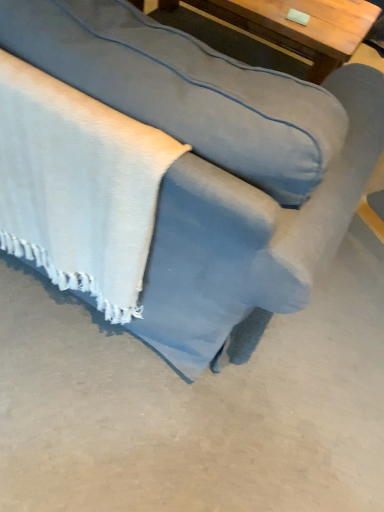
Describe the element at coordinates (217, 167) in the screenshot. I see `suede-like blue couch at center` at that location.

Find the location of a particular element. white textured blanket at lower left is located at coordinates (78, 187).

Looking at this image, is suede-like blue couch at center not near white textured blanket at lower left?

No, suede-like blue couch at center is not far away from white textured blanket at lower left.

Which of these two, suede-like blue couch at center or white textured blanket at lower left, stands taller?

suede-like blue couch at center is taller.

From a real-world perspective, which is physically below, suede-like blue couch at center or white textured blanket at lower left?

From a 3D spatial view, white textured blanket at lower left is below.

Is suede-like blue couch at center positioned with its back to white textured blanket at lower left?

Yes, suede-like blue couch at center's orientation is away from white textured blanket at lower left.

Is point (281, 152) positioned in front of point (256, 12)?

Yes, point (281, 152) is in front of point (256, 12).

Would you say suede-like blue couch at center is inside or outside wooden table at upper center?

suede-like blue couch at center cannot be found inside wooden table at upper center.

From a real-world perspective, who is located lower, suede-like blue couch at center or wooden table at upper center?

wooden table at upper center, from a real-world perspective.

From the image's perspective, which is above, suede-like blue couch at center or wooden table at upper center?

wooden table at upper center.

In the image, is white textured blanket at lower left positioned in front of or behind suede-like blue couch at center?

Visually, white textured blanket at lower left is located behind suede-like blue couch at center.

From the image's perspective, is white textured blanket at lower left over suede-like blue couch at center?

No, from the image's perspective, white textured blanket at lower left is not over suede-like blue couch at center.

Is white textured blanket at lower left at the right side of suede-like blue couch at center?

In fact, white textured blanket at lower left is to the left of suede-like blue couch at center.

Is there a large distance between white textured blanket at lower left and suede-like blue couch at center?

Actually, white textured blanket at lower left and suede-like blue couch at center are a little close together.

Who is shorter, white textured blanket at lower left or wooden table at upper center?

With less height is wooden table at upper center.

Where is `table on the right of white textured blanket at lower left`? table on the right of white textured blanket at lower left is located at coordinates (287, 30).

Looking at this image, is there a large distance between white textured blanket at lower left and wooden table at upper center?

white textured blanket at lower left is positioned a significant distance from wooden table at upper center.

How far apart are white textured blanket at lower left and wooden table at upper center?

white textured blanket at lower left and wooden table at upper center are 1.49 meters apart.

Considering the sizes of wooden table at upper center and white textured blanket at lower left in the image, is wooden table at upper center wider or thinner than white textured blanket at lower left?

wooden table at upper center is wider than white textured blanket at lower left.

From the picture: Can you tell me how much wooden table at upper center and white textured blanket at lower left differ in facing direction?

179 degrees.

From a real-world perspective, who is located lower, wooden table at upper center or white textured blanket at lower left?

From a 3D spatial view, wooden table at upper center is below.

Looking at this image, does wooden table at upper center have a larger size compared to white textured blanket at lower left?

Yes, wooden table at upper center is bigger than white textured blanket at lower left.

Which object is wider, wooden table at upper center or suede-like blue couch at center?

suede-like blue couch at center.

Is wooden table at upper center facing away from suede-like blue couch at center?

Yes, wooden table at upper center's orientation is away from suede-like blue couch at center.

Considering the relative sizes of wooden table at upper center and suede-like blue couch at center in the image provided, is wooden table at upper center bigger than suede-like blue couch at center?

Result: Actually, wooden table at upper center might be smaller than suede-like blue couch at center.

From the image's perspective, is wooden table at upper center above or below suede-like blue couch at center?

Clearly, from the image's perspective, wooden table at upper center is above suede-like blue couch at center.

Where is `blanket behind the suede-like blue couch at center`? The image size is (384, 512). blanket behind the suede-like blue couch at center is located at coordinates (78, 187).

Identify the location of table that is on the right side of suede-like blue couch at center. (287, 30).

Considering their positions, is wooden table at upper center positioned further to suede-like blue couch at center than white textured blanket at lower left?

The object further to suede-like blue couch at center is wooden table at upper center.

Looking at this image, when comparing their distances from wooden table at upper center, does white textured blanket at lower left or suede-like blue couch at center seem closer?

Among the two, suede-like blue couch at center is located nearer to wooden table at upper center.

Looking at the image, which one is located further to suede-like blue couch at center, white textured blanket at lower left or wooden table at upper center?

Based on the image, wooden table at upper center appears to be further to suede-like blue couch at center.

In the scene shown: When comparing their distances from white textured blanket at lower left, does wooden table at upper center or suede-like blue couch at center seem closer?

suede-like blue couch at center is positioned closer to the anchor white textured blanket at lower left.

Looking at the image, which one is located closer to white textured blanket at lower left, suede-like blue couch at center or wooden table at upper center?

The object closer to white textured blanket at lower left is suede-like blue couch at center.

From the image, which object appears to be nearer to wooden table at upper center, suede-like blue couch at center or white textured blanket at lower left?

Among the two, suede-like blue couch at center is located nearer to wooden table at upper center.

I want to click on blanket between suede-like blue couch at center and wooden table at upper center from front to back, so click(78, 187).